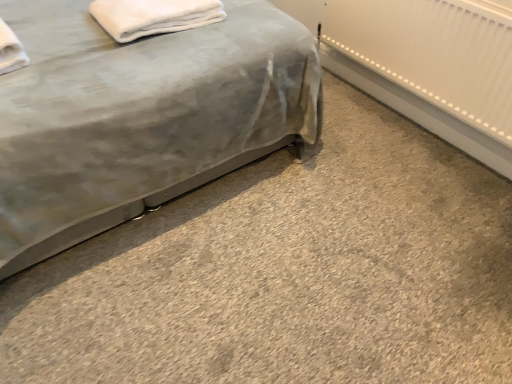
This screenshot has height=384, width=512. What do you see at coordinates (140, 116) in the screenshot?
I see `velvet gray bed at lower left` at bounding box center [140, 116].

The image size is (512, 384). I want to click on velvet gray bed at lower left, so click(140, 116).

Measure the distance between white fluffy towel at upper left and camera.

white fluffy towel at upper left and camera are 4.87 feet apart from each other.

The height and width of the screenshot is (384, 512). Describe the element at coordinates (153, 16) in the screenshot. I see `white fluffy towel at upper left` at that location.

The image size is (512, 384). What are the coordinates of `white fluffy towel at upper left` in the screenshot? It's located at [x=153, y=16].

At what (x,y) coordinates should I click in order to perform the action: click on velvet gray bed at lower left. Please return your answer as a coordinate pair (x, y). The height and width of the screenshot is (384, 512). Looking at the image, I should click on (140, 116).

Is velvet gray bed at lower left to the left of white fluffy towel at upper left from the viewer's perspective?

Correct, you'll find velvet gray bed at lower left to the left of white fluffy towel at upper left.

Based on the photo, does velvet gray bed at lower left come behind white fluffy towel at upper left?

No, it is in front of white fluffy towel at upper left.

Does point (298, 121) appear closer or farther from the camera than point (95, 15)?

Point (298, 121) is farther from the camera than point (95, 15).

From the image's perspective, between velvet gray bed at lower left and white fluffy towel at upper left, who is located below?

white fluffy towel at upper left.

From a real-world perspective, is velvet gray bed at lower left below white fluffy towel at upper left?

Yes, from a real-world perspective, velvet gray bed at lower left is under white fluffy towel at upper left.

Can you confirm if velvet gray bed at lower left is thinner than white fluffy towel at upper left?

No.

Can you confirm if velvet gray bed at lower left is shorter than white fluffy towel at upper left?

No.

In terms of size, does velvet gray bed at lower left appear bigger or smaller than white fluffy towel at upper left?

Clearly, velvet gray bed at lower left is larger in size than white fluffy towel at upper left.

Is velvet gray bed at lower left surrounding white fluffy towel at upper left?

Indeed, white fluffy towel at upper left is located within velvet gray bed at lower left.

In the scene shown: Is velvet gray bed at lower left in contact with white fluffy towel at upper left?

No, velvet gray bed at lower left is not next to white fluffy towel at upper left.

Could you tell me if velvet gray bed at lower left is facing white fluffy towel at upper left?

Yes, velvet gray bed at lower left faces towards white fluffy towel at upper left.

How many degrees apart are the facing directions of velvet gray bed at lower left and white fluffy towel at upper left?

The angular difference between velvet gray bed at lower left and white fluffy towel at upper left is 2.47 degrees.

Image resolution: width=512 pixels, height=384 pixels. Identify the location of material that is below the velvet gray bed at lower left (from the image's perspective). (153, 16).

Is white fluffy towel at upper left at the left side of velvet gray bed at lower left?

In fact, white fluffy towel at upper left is to the right of velvet gray bed at lower left.

Which object is closer to the camera taking this photo, white fluffy towel at upper left or velvet gray bed at lower left?

velvet gray bed at lower left is closer to the camera.

Between point (139, 7) and point (73, 186), which one is positioned in front?

Point (73, 186)

From the image's perspective, is white fluffy towel at upper left located above or below velvet gray bed at lower left?

Clearly, from the image's perspective, white fluffy towel at upper left is below velvet gray bed at lower left.

From a real-world perspective, is white fluffy towel at upper left on velvet gray bed at lower left?

Yes, from a real-world perspective, white fluffy towel at upper left is over velvet gray bed at lower left

Does white fluffy towel at upper left have a lesser width compared to velvet gray bed at lower left?

Indeed, white fluffy towel at upper left has a lesser width compared to velvet gray bed at lower left.

Is white fluffy towel at upper left shorter than velvet gray bed at lower left?

Yes, white fluffy towel at upper left is shorter than velvet gray bed at lower left.

Can you confirm if white fluffy towel at upper left is smaller than velvet gray bed at lower left?

Correct, white fluffy towel at upper left occupies less space than velvet gray bed at lower left.

Is velvet gray bed at lower left located within white fluffy towel at upper left?

Definitely not — velvet gray bed at lower left is not inside white fluffy towel at upper left.

Are white fluffy towel at upper left and velvet gray bed at lower left far apart?

Actually, white fluffy towel at upper left and velvet gray bed at lower left are a little close together.

Does white fluffy towel at upper left turn towards velvet gray bed at lower left?

Yes, white fluffy towel at upper left is facing velvet gray bed at lower left.

How distant is white fluffy towel at upper left from velvet gray bed at lower left?

11.37 inches.

Identify the location of bed below the white fluffy towel at upper left (from a real-world perspective). This screenshot has height=384, width=512. click(140, 116).

Find the location of a particular element. The width and height of the screenshot is (512, 384). material behind the velvet gray bed at lower left is located at coordinates (153, 16).

This screenshot has height=384, width=512. I want to click on material that is above the velvet gray bed at lower left (from a real-world perspective), so click(x=153, y=16).